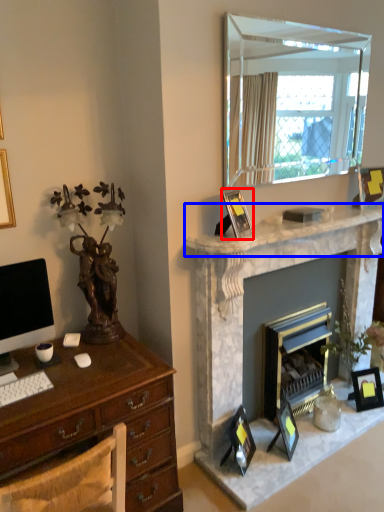
Question: Which object is closer to the camera taking this photo, picture frame (highlighted by a red box) or mantle (highlighted by a blue box)?

Choices:
 (A) picture frame
 (B) mantle

Answer: (B)